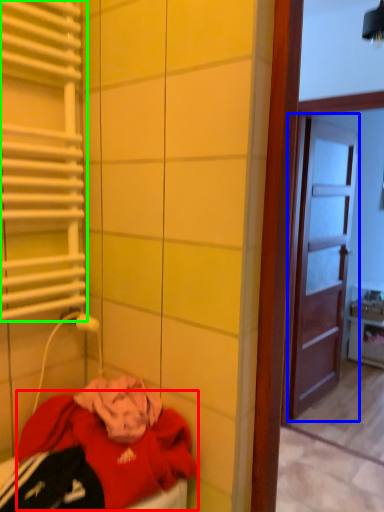
Question: Based on their relative distances, which object is nearer to clothing (highlighted by a red box)? Choose from door (highlighted by a blue box) and shutter (highlighted by a green box).

Choices:
 (A) door
 (B) shutter

Answer: (B)